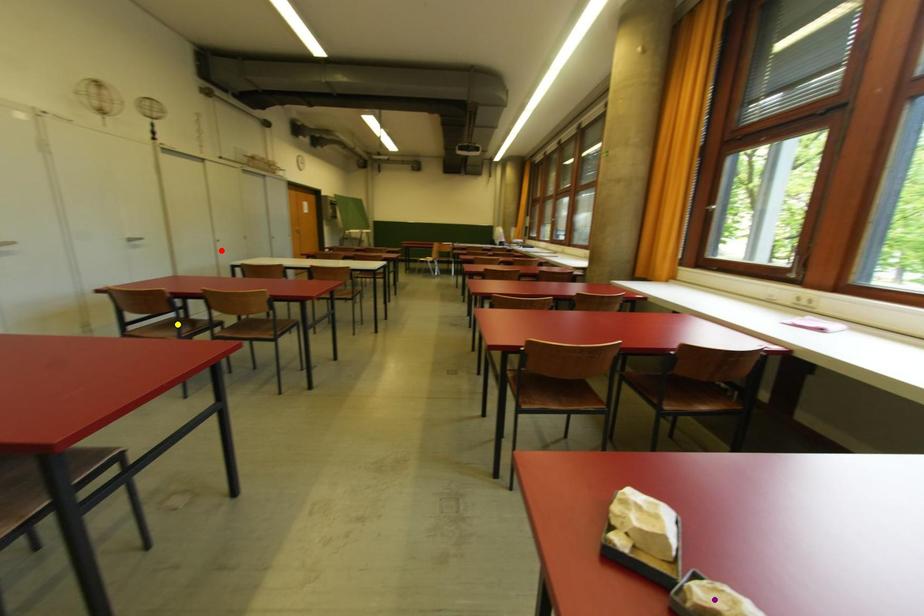
Order these from nearest to farthest:
yellow point
purple point
red point

purple point
yellow point
red point